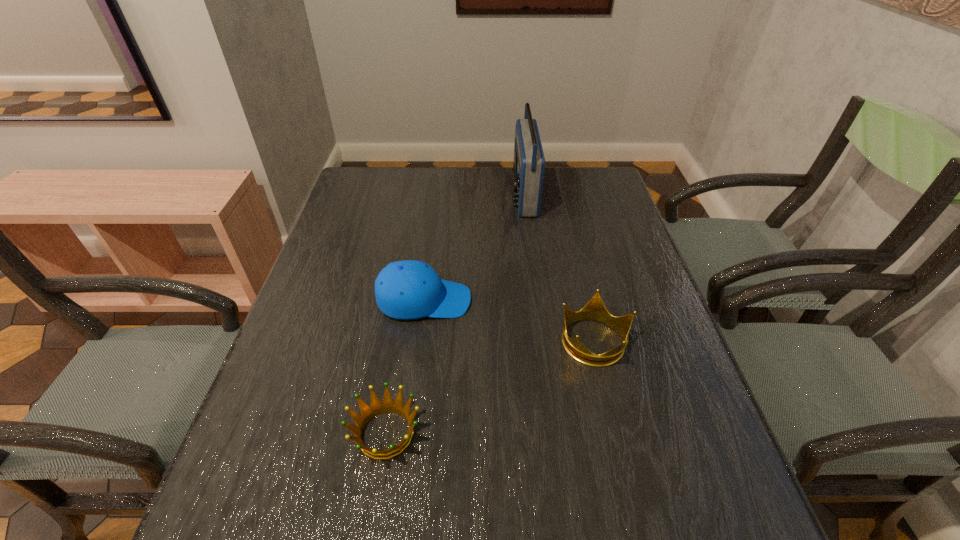
This screenshot has height=540, width=960. In order to click on vacant space located 0.280m on the front-facing side of the second tallest object in this screenshot , I will do `click(586, 300)`.

I want to click on vacant space located on the left of the taller crown, so click(506, 340).

The image size is (960, 540). Find the location of `free region located on the right of the shorter crown`. free region located on the right of the shorter crown is located at coordinates (475, 433).

Image resolution: width=960 pixels, height=540 pixels. I want to click on object that is at the far edge, so click(x=529, y=162).

The width and height of the screenshot is (960, 540). What are the coordinates of `object that is at the right edge` in the screenshot? It's located at (595, 309).

At what (x,y) coordinates should I click in order to perform the action: click on vacant space at the far edge of the desktop. Please return your answer as a coordinate pair (x, y). Looking at the image, I should click on (559, 169).

Identify the location of vacant space at the left edge of the desktop. This screenshot has width=960, height=540. (368, 217).

Locate an element on the screen. vacant area at the right edge of the desktop is located at coordinates (613, 272).

You are a GUI agent. You are given a task and a screenshot of the screen. Output one action in this format:
    pyautogui.click(x=<x>, y=<y>)
    Task: Click on the vacant space at the far left corner of the desktop
    The image size is (960, 540).
    Given the screenshot: What is the action you would take?
    pyautogui.click(x=394, y=193)

The height and width of the screenshot is (540, 960). In order to click on free space that is in between the nearest object and the right crown in this screenshot , I will do `click(490, 387)`.